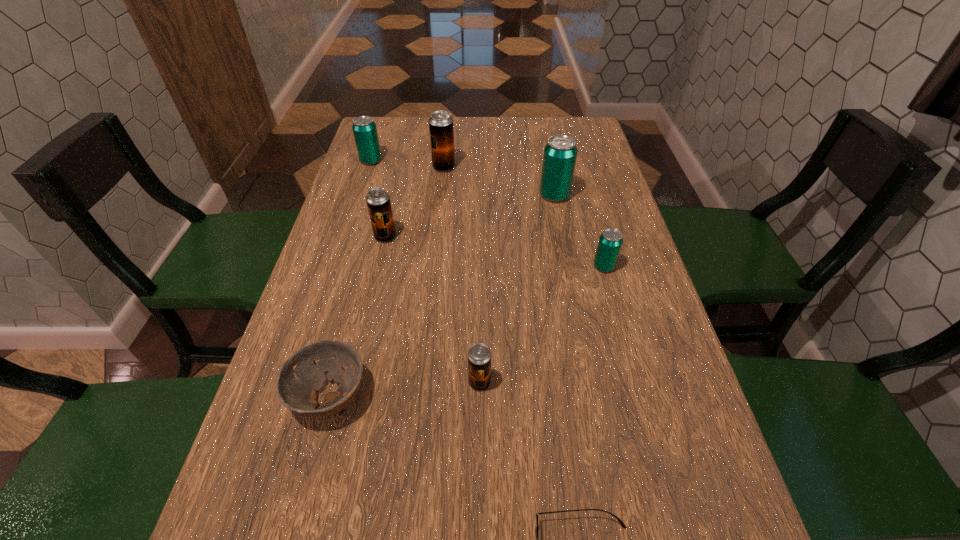
Choose which black beer can is the nearest neighbor to the fourth beer can from left to right. Please provide its 2D coordinates. Your answer should be formatted as a tuple, i.e. [(x, y)], where the tuple contains the x and y coordinates of a point satisfying the conditions above.

[(378, 201)]

This screenshot has height=540, width=960. Find the location of `teal beer can that is the third closest to the nearest object`. teal beer can that is the third closest to the nearest object is located at coordinates (364, 128).

Locate which teal beer can is the third closest to the brown bowl. Please provide its 2D coordinates. Your answer should be formatted as a tuple, i.e. [(x, y)], where the tuple contains the x and y coordinates of a point satisfying the conditions above.

[(364, 128)]

Locate an element on the screen. This screenshot has width=960, height=540. vacant space that satisfies the following two spatial constraints: 1. on the back side of the nearest beer can; 2. on the left side of the bowl is located at coordinates click(x=333, y=382).

I want to click on vacant space that satisfies the following two spatial constraints: 1. on the front side of the rightmost object; 2. on the left side of the biggest black beer can, so click(x=434, y=267).